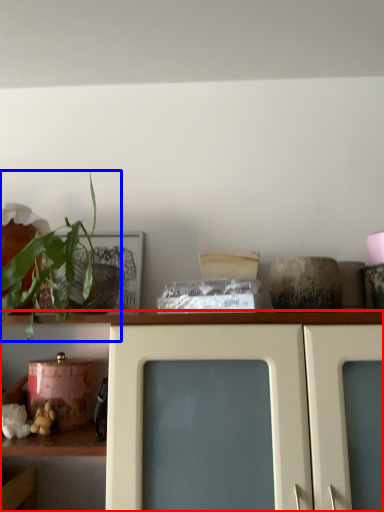
Question: Which object appears closest to the camera in this image, shelf (highlighted by a red box) or houseplant (highlighted by a blue box)?

Choices:
 (A) shelf
 (B) houseplant

Answer: (B)